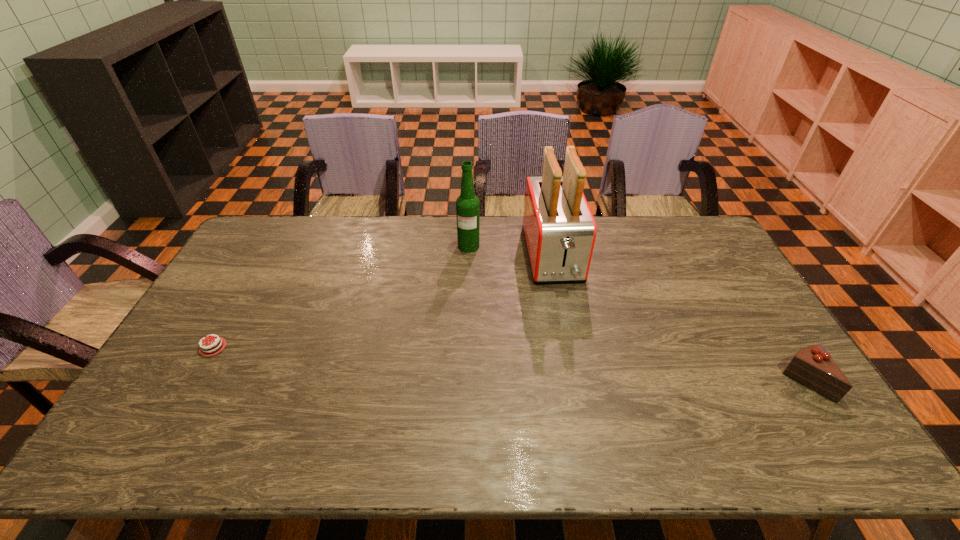
Where is `the shorter chocolate cake`? This screenshot has height=540, width=960. the shorter chocolate cake is located at coordinates (215, 345).

This screenshot has width=960, height=540. Identify the location of the leftmost object. (215, 345).

You are a GUI agent. You are given a task and a screenshot of the screen. Output one action in this format:
    pyautogui.click(x=<x>, y=<y>)
    Task: Click on the rightmost object
    The width and height of the screenshot is (960, 540).
    Given the screenshot: What is the action you would take?
    pyautogui.click(x=812, y=366)

Find the location of a particular element. The height and width of the screenshot is (540, 960). the second shortest object is located at coordinates (812, 366).

This screenshot has height=540, width=960. I want to click on the third object from right to left, so 467,204.

Image resolution: width=960 pixels, height=540 pixels. What are the coordinates of `the second object from right to left` in the screenshot? It's located at (559, 229).

This screenshot has width=960, height=540. Identify the location of blank space located 0.170m on the right of the left chocolate cake. (303, 347).

Identify the location of blank area located on the left of the third tallest object. (661, 382).

Image resolution: width=960 pixels, height=540 pixels. I want to click on free space located 0.400m on the label of the beer bottle, so click(x=458, y=340).

Where is `free space located on the label of the beer bottle`? free space located on the label of the beer bottle is located at coordinates (459, 330).